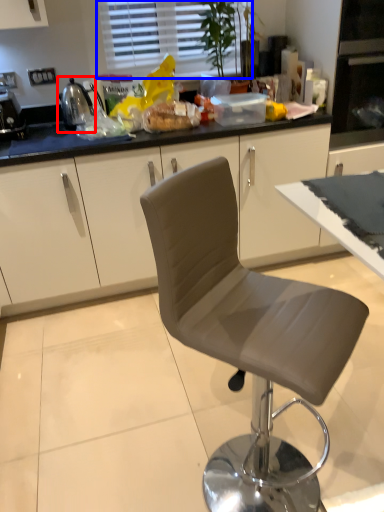
Question: Which of the following is the farthest to the observer, appliance (highlighted by a red box) or window (highlighted by a blue box)?

Choices:
 (A) appliance
 (B) window

Answer: (B)